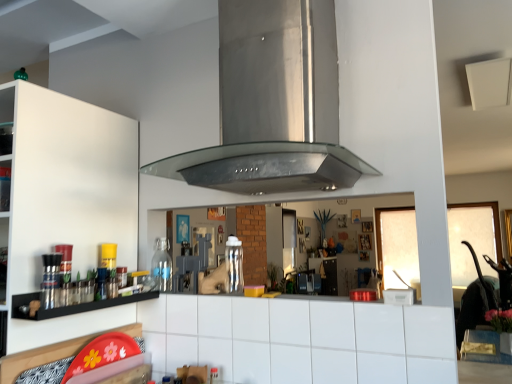
Where is `vacant area on top of black glass shelf at left (from a real-world perspective)`? Image resolution: width=512 pixels, height=384 pixels. vacant area on top of black glass shelf at left (from a real-world perspective) is located at coordinates (92, 287).